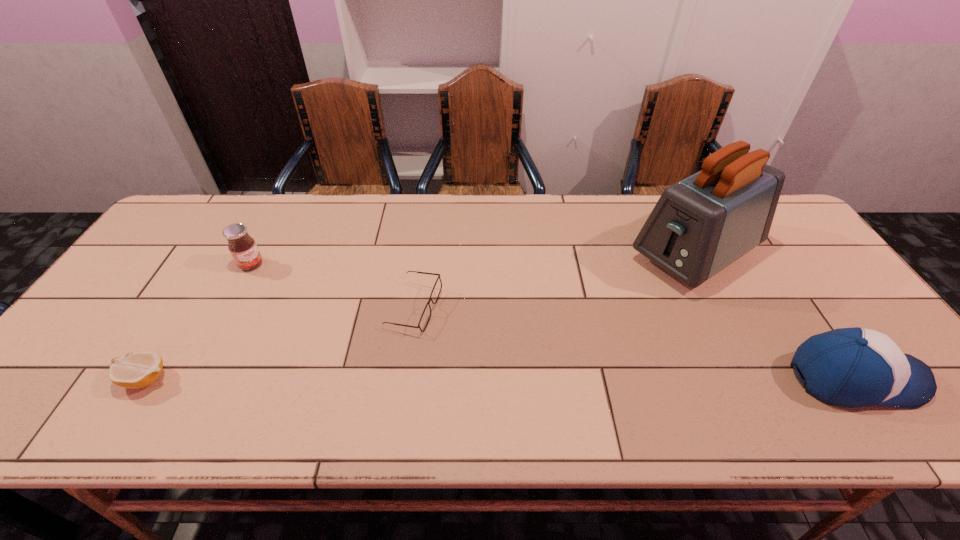
Find the location of `vacant space on the desktop that is between the leftmost object and the baseball cap and is positioned with the lenses facing outward on the third object from right to left`. vacant space on the desktop that is between the leftmost object and the baseball cap and is positioned with the lenses facing outward on the third object from right to left is located at coordinates (506, 379).

At what (x,y) coordinates should I click in order to perform the action: click on free spot on the desktop that is between the leftmost object and the baseball cap and is positioned on the label side of the jam. Please return your answer as a coordinate pair (x, y). The height and width of the screenshot is (540, 960). Looking at the image, I should click on (395, 379).

Identify the location of vacant space on the desktop that is between the lemon and the baseball cap and is positioned on the front-facing side of the tallest object. (498, 379).